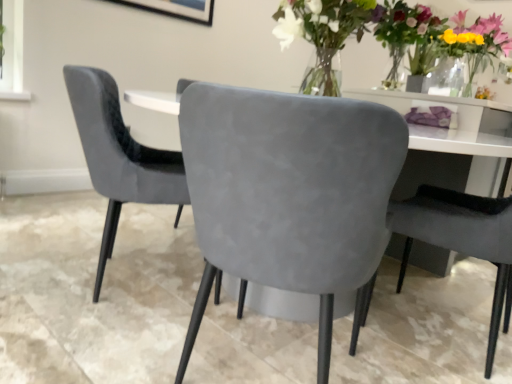
This screenshot has height=384, width=512. I want to click on velvet grey chair at center, which is the third chair from right to left, so click(x=119, y=156).

What are the coordinates of `suede gray chair at center, which ranks as the first chair in right-to-left order` in the screenshot? It's located at (462, 239).

Based on the photo, what is the approximate height of matte glass vase at upper right?

It is 25.68 inches.

Image resolution: width=512 pixels, height=384 pixels. In order to click on matte glass vase at upper right in this screenshot , I will do `click(435, 39)`.

Identify the location of velvet grey chair at center, placed as the first chair when sorted from left to right. (119, 156).

Based on their positions, is velvet grey chair at center, placed as the first chair when sorted from left to right, located to the left or right of suede gray chair at center, placed as the second chair when sorted from left to right?

Clearly, velvet grey chair at center, placed as the first chair when sorted from left to right, is on the left of suede gray chair at center, placed as the second chair when sorted from left to right, in the image.

From the image's perspective, would you say velvet grey chair at center, placed as the first chair when sorted from left to right, is shown under suede gray chair at center, placed as the second chair when sorted from left to right?

No.

Consider the image. Is velvet grey chair at center, which is the third chair from right to left, facing away from suede gray chair at center, placed as the second chair when sorted from left to right?

velvet grey chair at center, which is the third chair from right to left, is not turned away from suede gray chair at center, placed as the second chair when sorted from left to right.

Is velvet grey chair at center, placed as the first chair when sorted from left to right, wider or thinner than suede gray chair at center, which appears as the second chair when viewed from the right?

Considering their sizes, velvet grey chair at center, placed as the first chair when sorted from left to right, looks slimmer than suede gray chair at center, which appears as the second chair when viewed from the right.

Which of these two, velvet grey chair at center, which is the third chair from right to left, or suede gray chair at center, which ranks as the first chair in right-to-left order, is smaller?

suede gray chair at center, which ranks as the first chair in right-to-left order.

Is velvet grey chair at center, placed as the first chair when sorted from left to right, facing away from suede gray chair at center, which ranks as the first chair in right-to-left order?

No, velvet grey chair at center, placed as the first chair when sorted from left to right, is not facing away from suede gray chair at center, which ranks as the first chair in right-to-left order.

Who is taller, velvet grey chair at center, placed as the first chair when sorted from left to right, or suede gray chair at center, which ranks as the first chair in right-to-left order?

velvet grey chair at center, placed as the first chair when sorted from left to right.

At what (x,y) coordinates should I click in order to perform the action: click on chair above the suede gray chair at center, marked as the third chair in a left-to-right arrangement (from the image's perspective). Please return your answer as a coordinate pair (x, y). Looking at the image, I should click on 119,156.

Considering the relative sizes of suede gray chair at center, placed as the second chair when sorted from left to right, and suede gray chair at center, marked as the third chair in a left-to-right arrangement, in the image provided, is suede gray chair at center, placed as the second chair when sorted from left to right, bigger than suede gray chair at center, marked as the third chair in a left-to-right arrangement,?

Correct, suede gray chair at center, placed as the second chair when sorted from left to right, is larger in size than suede gray chair at center, marked as the third chair in a left-to-right arrangement.

Is there a large distance between suede gray chair at center, placed as the second chair when sorted from left to right, and suede gray chair at center, which ranks as the first chair in right-to-left order?

Actually, suede gray chair at center, placed as the second chair when sorted from left to right, and suede gray chair at center, which ranks as the first chair in right-to-left order, are a little close together.

From a real-world perspective, is suede gray chair at center, which appears as the second chair when viewed from the right, below suede gray chair at center, marked as the third chair in a left-to-right arrangement?

No, from a real-world perspective, suede gray chair at center, which appears as the second chair when viewed from the right, is not beneath suede gray chair at center, marked as the third chair in a left-to-right arrangement.

Considering the relative sizes of matte glass vase at upper right and suede gray chair at center, marked as the third chair in a left-to-right arrangement, in the image provided, is matte glass vase at upper right shorter than suede gray chair at center, marked as the third chair in a left-to-right arrangement,?

Indeed, matte glass vase at upper right has a lesser height compared to suede gray chair at center, marked as the third chair in a left-to-right arrangement.

Relative to suede gray chair at center, marked as the third chair in a left-to-right arrangement, is matte glass vase at upper right in front or behind?

Clearly, matte glass vase at upper right is behind suede gray chair at center, marked as the third chair in a left-to-right arrangement.

Considering the positions of points (473, 62) and (458, 210), is point (473, 62) closer to camera compared to point (458, 210)?

No, (473, 62) is further to viewer.

Consider the image. Considering the relative sizes of velvet grey chair at center, which is the third chair from right to left, and matte glass vase at upper right in the image provided, is velvet grey chair at center, which is the third chair from right to left, shorter than matte glass vase at upper right?

No, velvet grey chair at center, which is the third chair from right to left, is not shorter than matte glass vase at upper right.

Does velvet grey chair at center, placed as the first chair when sorted from left to right, come in front of matte glass vase at upper right?

Yes, velvet grey chair at center, placed as the first chair when sorted from left to right, is closer to the viewer.

From the matte glass vase at upper right, count 1st chairs forward and point to it. Please provide its 2D coordinates.

[(119, 156)]

Is suede gray chair at center, which ranks as the first chair in right-to-left order, completely or partially outside of velvet grey chair at center, which is the third chair from right to left?

Yes, suede gray chair at center, which ranks as the first chair in right-to-left order, is not within velvet grey chair at center, which is the third chair from right to left.

Is suede gray chair at center, marked as the third chair in a left-to-right arrangement, taller than velvet grey chair at center, placed as the first chair when sorted from left to right?

No.

Which is more to the right, suede gray chair at center, which ranks as the first chair in right-to-left order, or velvet grey chair at center, which is the third chair from right to left?

suede gray chair at center, which ranks as the first chair in right-to-left order, is more to the right.

Considering the positions of points (210, 254) and (454, 43), is point (210, 254) farther from camera compared to point (454, 43)?

No, it is in front of (454, 43).

In terms of height, does suede gray chair at center, placed as the second chair when sorted from left to right, look taller or shorter compared to matte glass vase at upper right?

In the image, suede gray chair at center, placed as the second chair when sorted from left to right, appears to be taller than matte glass vase at upper right.

How many degrees apart are the facing directions of suede gray chair at center, which appears as the second chair when viewed from the right, and matte glass vase at upper right?

suede gray chair at center, which appears as the second chair when viewed from the right, and matte glass vase at upper right are facing 112 degrees away from each other.

In order to click on the 1st chair counting from the right of the velvet grey chair at center, which is the third chair from right to left in this screenshot , I will do `click(289, 194)`.

From a real-world perspective, which chair is the 2nd one underneath the velvet grey chair at center, placed as the first chair when sorted from left to right? Please provide its 2D coordinates.

[(462, 239)]

Which object lies nearer to the anchor point suede gray chair at center, placed as the second chair when sorted from left to right, matte glass vase at upper right or suede gray chair at center, which ranks as the first chair in right-to-left order?

Based on the image, suede gray chair at center, which ranks as the first chair in right-to-left order, appears to be nearer to suede gray chair at center, placed as the second chair when sorted from left to right.

Considering their positions, is velvet grey chair at center, which is the third chair from right to left, positioned further to suede gray chair at center, which ranks as the first chair in right-to-left order, than matte glass vase at upper right?

matte glass vase at upper right is positioned further to the anchor suede gray chair at center, which ranks as the first chair in right-to-left order.

Looking at the image, which one is located closer to velvet grey chair at center, which is the third chair from right to left, matte glass vase at upper right or suede gray chair at center, marked as the third chair in a left-to-right arrangement?

The object closer to velvet grey chair at center, which is the third chair from right to left, is suede gray chair at center, marked as the third chair in a left-to-right arrangement.

Which object lies further to the anchor point matte glass vase at upper right, suede gray chair at center, placed as the second chair when sorted from left to right, or suede gray chair at center, marked as the third chair in a left-to-right arrangement?

Based on the image, suede gray chair at center, placed as the second chair when sorted from left to right, appears to be further to matte glass vase at upper right.

Considering their positions, is matte glass vase at upper right positioned further to suede gray chair at center, marked as the third chair in a left-to-right arrangement, than suede gray chair at center, placed as the second chair when sorted from left to right?

matte glass vase at upper right lies further to suede gray chair at center, marked as the third chair in a left-to-right arrangement, than the other object.

When comparing their distances from matte glass vase at upper right, does velvet grey chair at center, which is the third chair from right to left, or suede gray chair at center, which appears as the second chair when viewed from the right, seem closer?

velvet grey chair at center, which is the third chair from right to left, lies closer to matte glass vase at upper right than the other object.

Considering their positions, is suede gray chair at center, which appears as the second chair when viewed from the right, positioned further to suede gray chair at center, which ranks as the first chair in right-to-left order, than matte glass vase at upper right?

Based on the image, matte glass vase at upper right appears to be further to suede gray chair at center, which ranks as the first chair in right-to-left order.

Which object lies further to the anchor point velvet grey chair at center, which is the third chair from right to left, suede gray chair at center, marked as the third chair in a left-to-right arrangement, or matte glass vase at upper right?

matte glass vase at upper right lies further to velvet grey chair at center, which is the third chair from right to left, than the other object.

Where is `chair located between velvet grey chair at center, placed as the first chair when sorted from left to right, and suede gray chair at center, marked as the third chair in a left-to-right arrangement, in the left-right direction`? The width and height of the screenshot is (512, 384). chair located between velvet grey chair at center, placed as the first chair when sorted from left to right, and suede gray chair at center, marked as the third chair in a left-to-right arrangement, in the left-right direction is located at coordinates (289, 194).